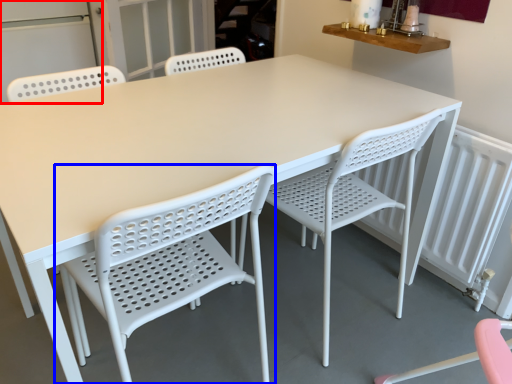
Question: Among these objects, which one is nearest to the camera, screen door (highlighted by a red box) or chair (highlighted by a blue box)?

Choices:
 (A) screen door
 (B) chair

Answer: (B)